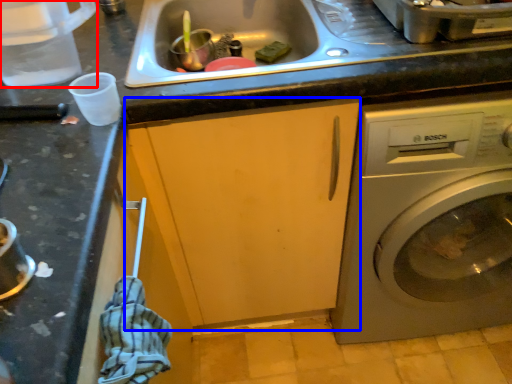
Question: Which of the following is the farthest to the observer, appliance (highlighted by a red box) or cabinetry (highlighted by a blue box)?

Choices:
 (A) appliance
 (B) cabinetry

Answer: (B)